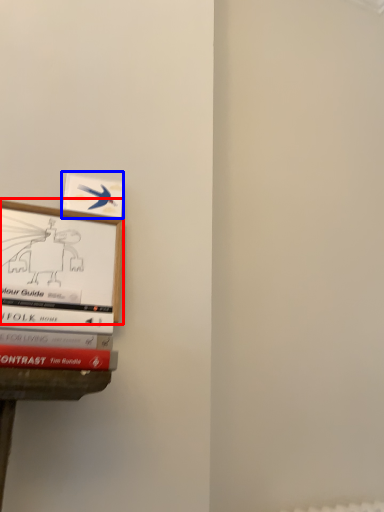
Question: Which point is closer to the camera, picture frame (highlighted by a red box) or book (highlighted by a blue box)?

Choices:
 (A) picture frame
 (B) book

Answer: (A)